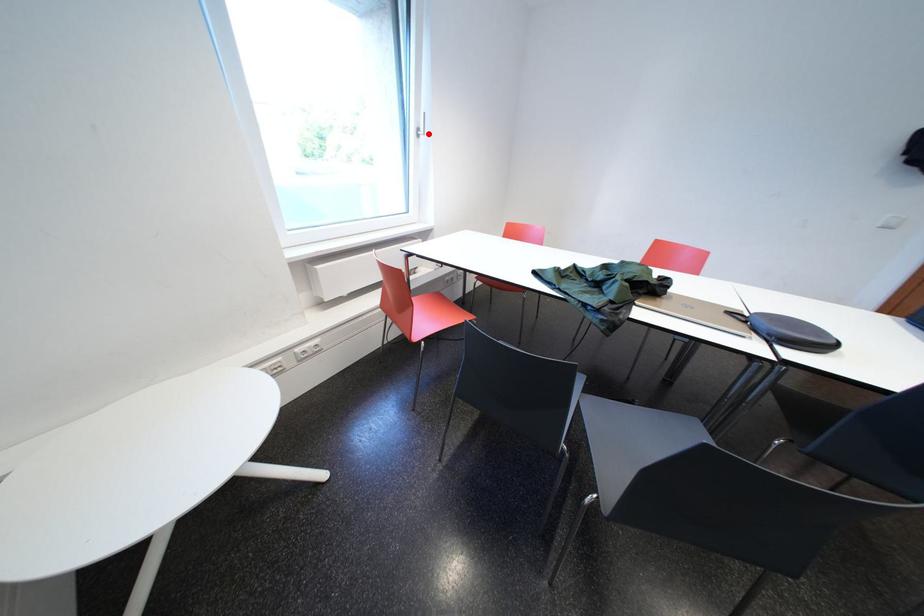
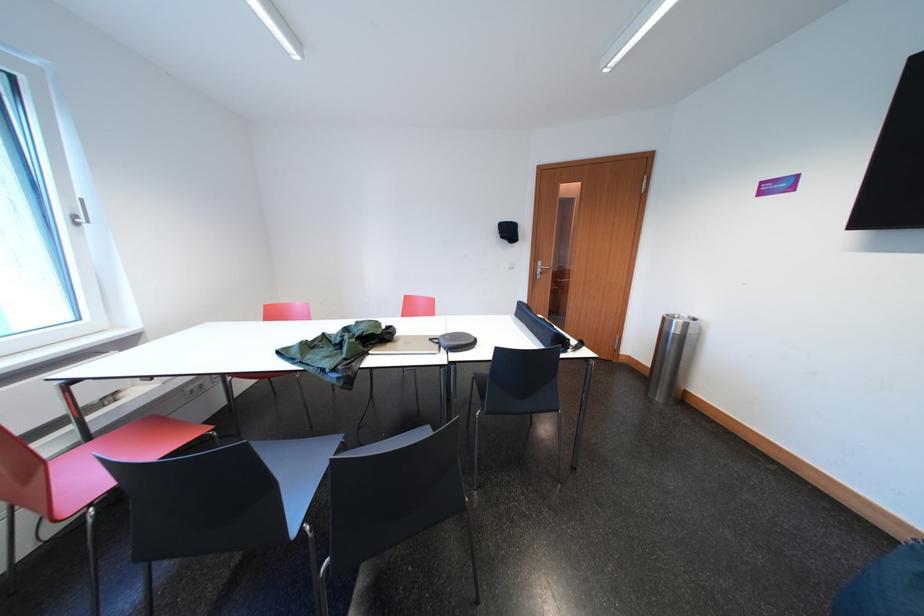
The point at the highlighted location is marked in the first image. Where is the corresponding point in the second image?

(84, 221)